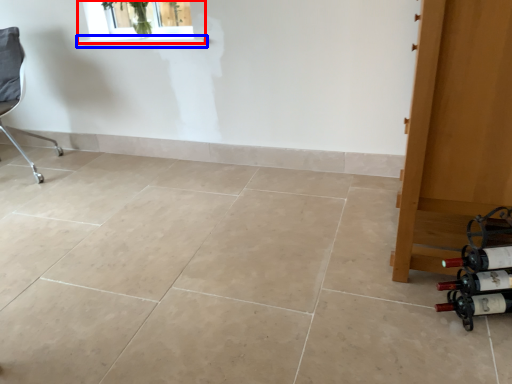
Question: Which point is closer to the camera, window (highlighted by a red box) or window sill (highlighted by a blue box)?

Choices:
 (A) window
 (B) window sill

Answer: (A)